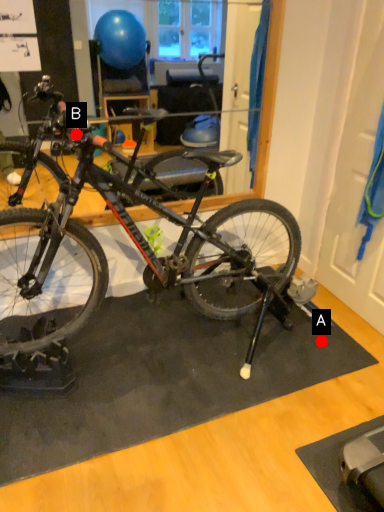
Question: Two points are circled on the image, labeled by A and B beside each circle. Among these points, which one is farthest from the camera?

Choices:
 (A) A is further
 (B) B is further

Answer: (B)